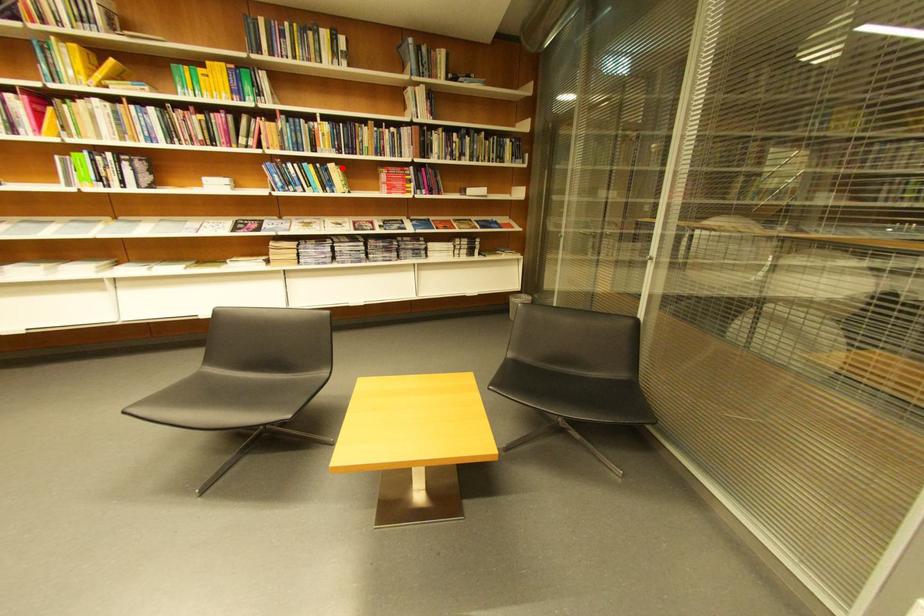
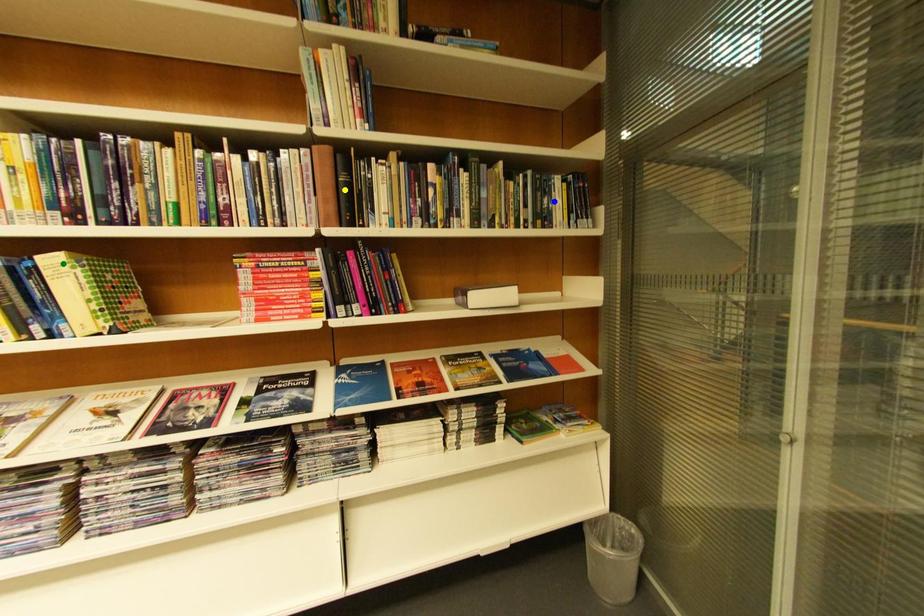
Question: I am providing you with two images of the same scene from different viewpoints. A red point is marked on the first image. You are given multiple points on the second image. In image 2, which mark is for the same physical point as the one in image 1?

Choices:
 (A) blue point
 (B) green point
 (C) yellow point

Answer: (B)